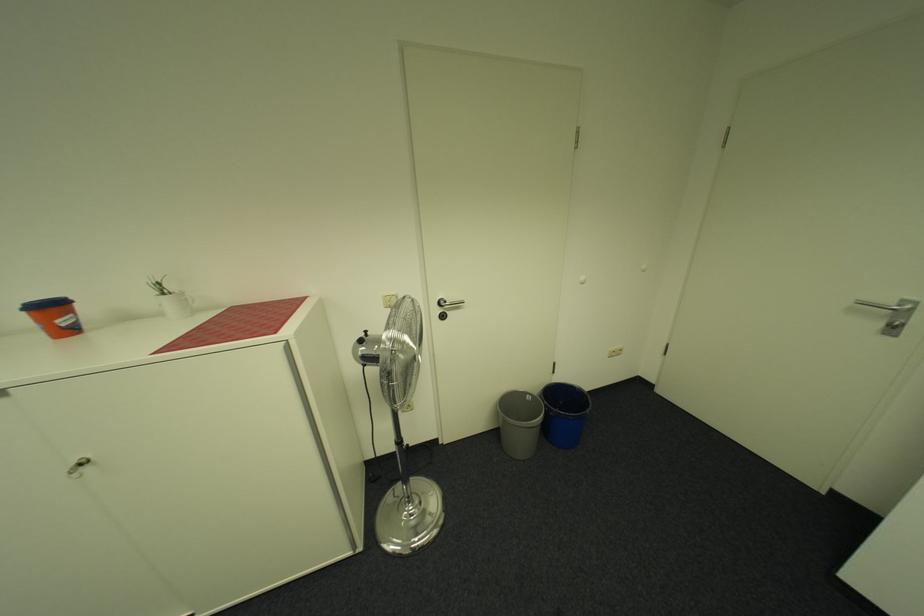
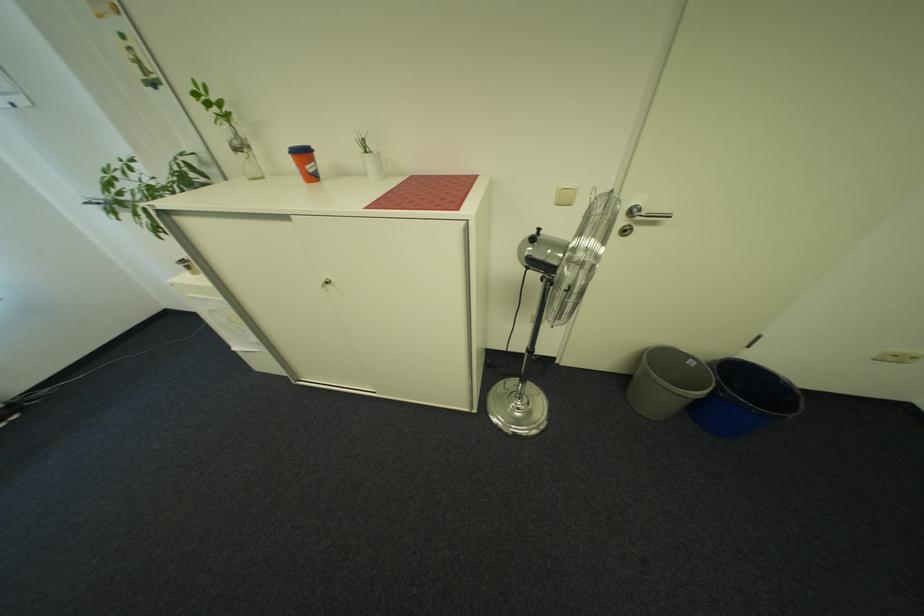
Find the pixel in the second image that matches point 371,342 in the first image.

(542, 240)